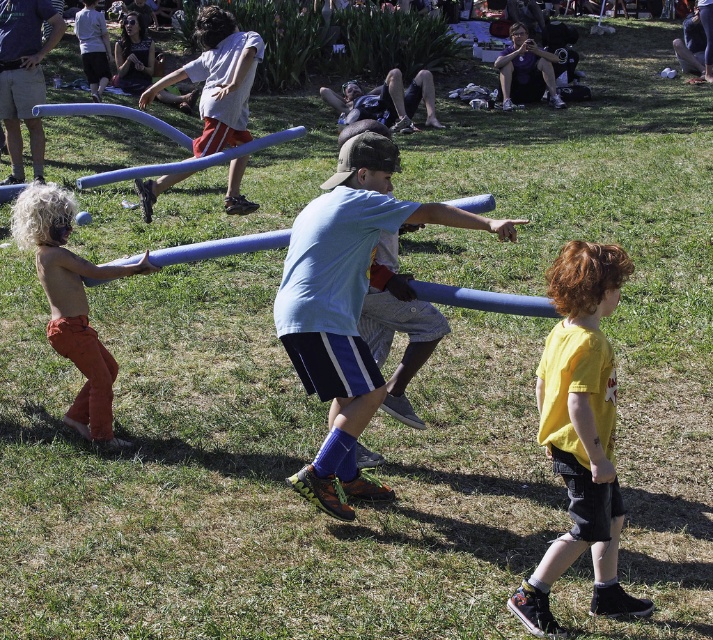
How distant is light blue fabric shirt at center from orange cotton pants at left?

light blue fabric shirt at center is 5.30 feet away from orange cotton pants at left.

Which of these two, light blue fabric shirt at center or orange cotton pants at left, stands shorter?

With less height is orange cotton pants at left.

What do you see at coordinates (347, 305) in the screenshot? I see `light blue fabric shirt at center` at bounding box center [347, 305].

Where is `light blue fabric shirt at center`? This screenshot has width=713, height=640. light blue fabric shirt at center is located at coordinates (347, 305).

Who is more forward, (600, 492) or (26, 100)?

Point (600, 492)

Who is taller, yellow matte shirt at right or matte blue pole at upper left?

matte blue pole at upper left is taller.

Between point (568, 493) and point (51, 33), which one is positioned behind?

Positioned behind is point (51, 33).

What are the coordinates of `yellow matte shirt at right` in the screenshot? It's located at (580, 433).

Does matte blue pole at upper left appear over matte black shirt at upper center?

Incorrect, matte blue pole at upper left is not positioned above matte black shirt at upper center.

I want to click on matte blue pole at upper left, so click(x=24, y=74).

Describe the element at coordinates (24, 74) in the screenshot. I see `matte blue pole at upper left` at that location.

Where is `matte blue pole at upper left`? matte blue pole at upper left is located at coordinates (24, 74).